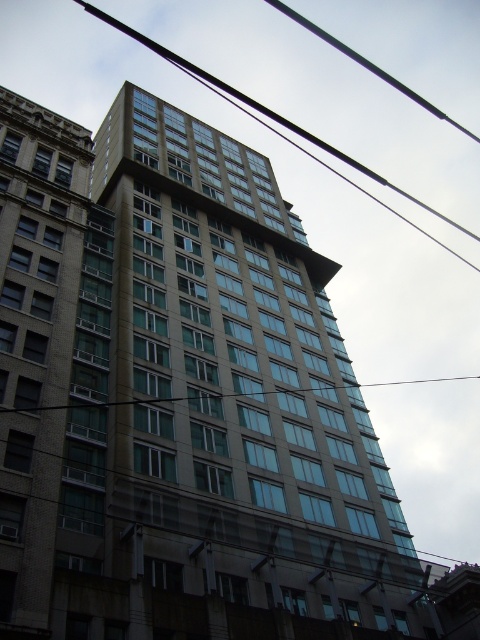
You are standing in front of the modern highrise and want to take a photo of the brown brick building at left and the transparent glass power line at center. Which object is positioned to the left of the other?

The brown brick building at left is to the left of the transparent glass power line at center.

From the picture: You are an architect evaluating the spatial relationship between the brown brick building at left and the metallic wire at upper center. Based on their sizes, which one would require more space for expansion without overlapping the other?

The brown brick building at left has a smaller size compared to metallic wire at upper center, so expanding the brown brick building at left would require more space to avoid overlapping the larger metallic wire at upper center.